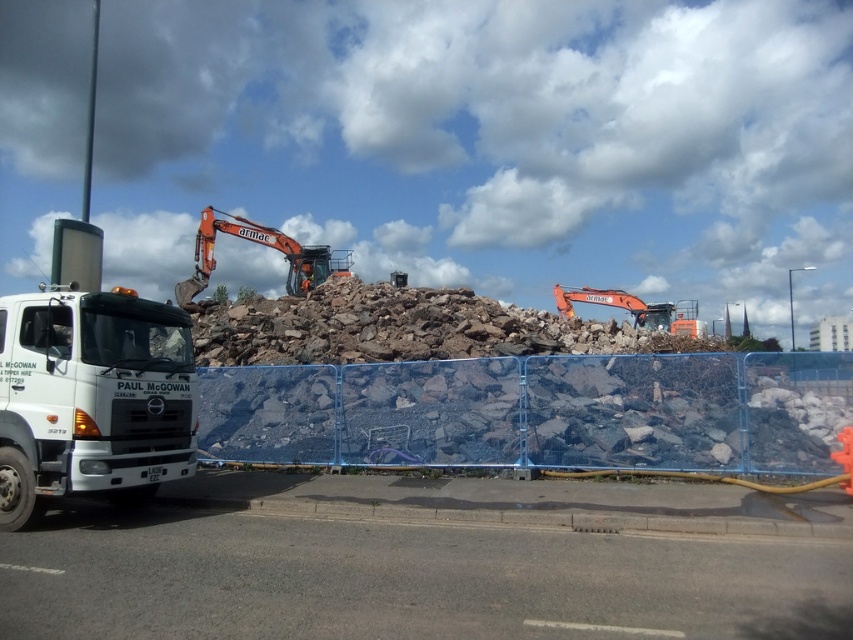
Question: Is blue plastic fence at center above orange metallic excavator at center?

Choices:
 (A) yes
 (B) no

Answer: (B)

Question: Which point is farther from the camera taking this photo?

Choices:
 (A) (32, 339)
 (B) (477, 410)

Answer: (B)

Question: Which point is closer to the camera?

Choices:
 (A) (590, 298)
 (B) (189, 385)

Answer: (B)

Question: Can you confirm if blue plastic fence at center is positioned below orange metallic excavator at upper center?

Choices:
 (A) yes
 (B) no

Answer: (A)

Question: Observing the image, what is the correct spatial positioning of blue plastic fence at center in reference to white matte truck at left?

Choices:
 (A) left
 (B) right

Answer: (B)

Question: Which object is positioned closest to the orange metallic excavator at upper center?

Choices:
 (A) white matte truck at left
 (B) orange metallic excavator at center
 (C) blue plastic fence at center

Answer: (C)